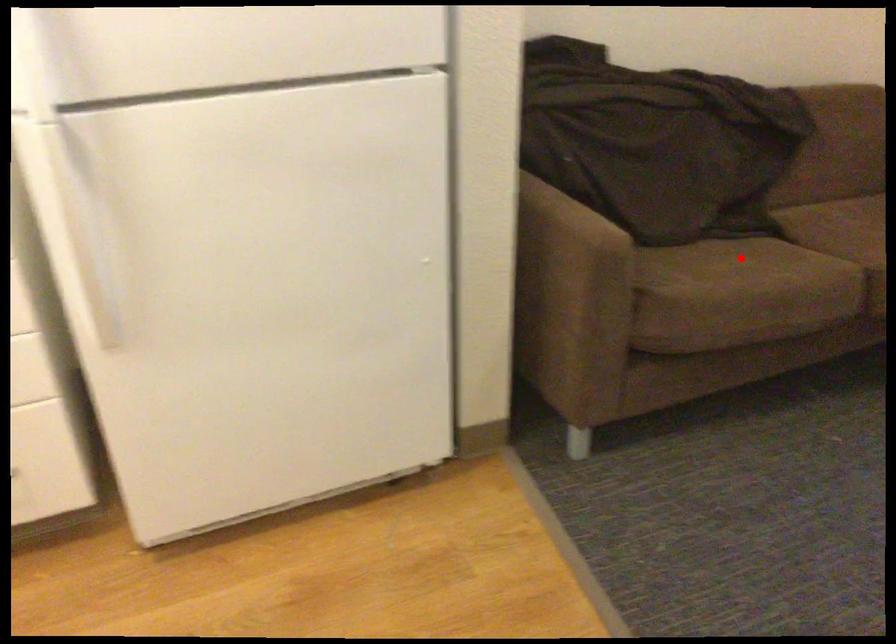
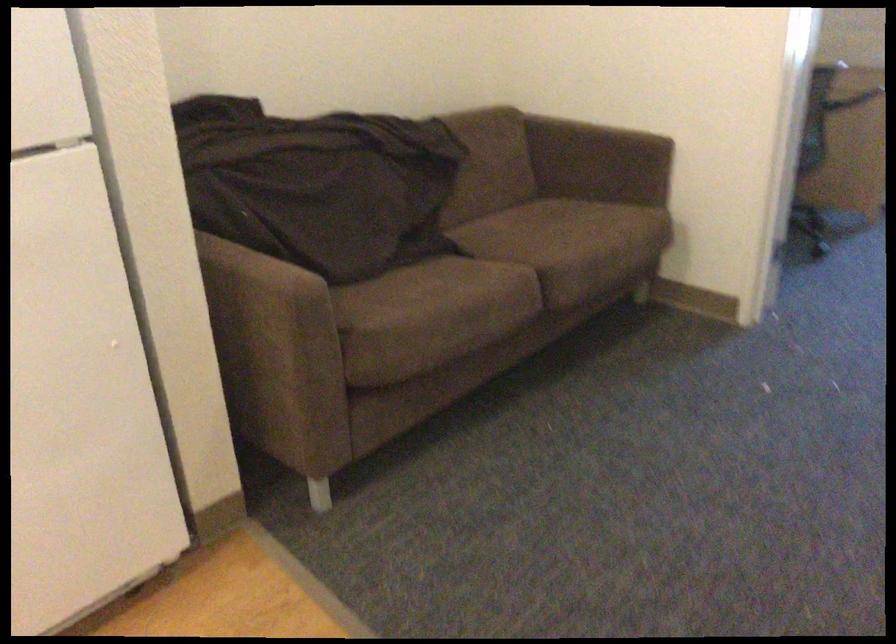
Where in the second image is the point corresponding to the highlighted location from the first image?

(429, 279)